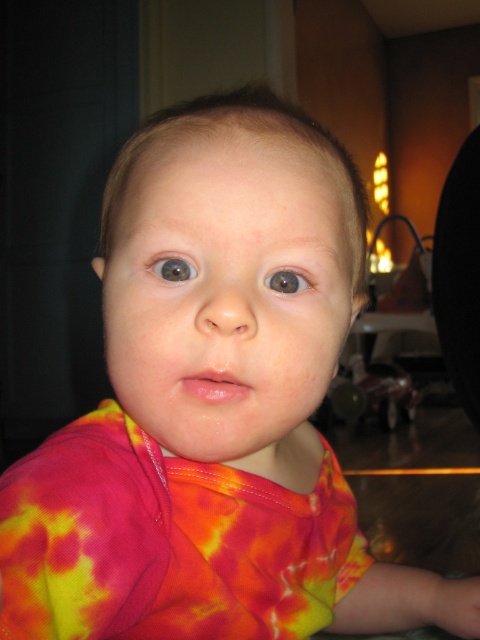
Question: Does blue glossy eye at center appear under brown matte eye at center?

Choices:
 (A) no
 (B) yes

Answer: (A)

Question: Does blue glossy eye at center have a greater width compared to brown matte eye at center?

Choices:
 (A) yes
 (B) no

Answer: (A)

Question: Is blue glossy eye at center thinner than brown matte eye at center?

Choices:
 (A) yes
 (B) no

Answer: (B)

Question: Which of the following is the closest to the observer?

Choices:
 (A) brown matte eye at center
 (B) blue glossy eye at center

Answer: (B)